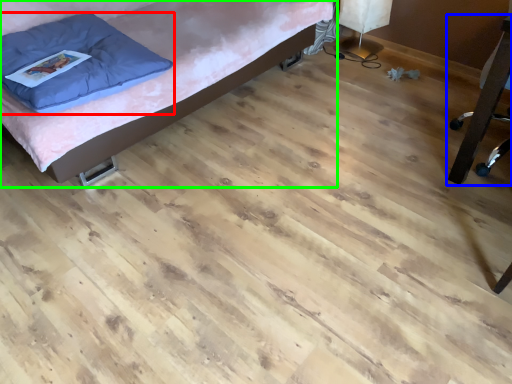
Question: Which is nearer to the pillow (highlighted by a red box)? furniture (highlighted by a blue box) or furniture (highlighted by a green box).

Choices:
 (A) furniture
 (B) furniture

Answer: (B)